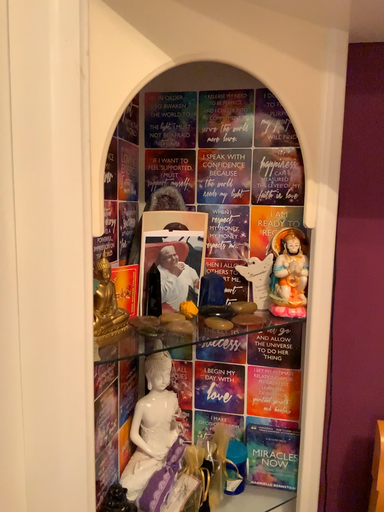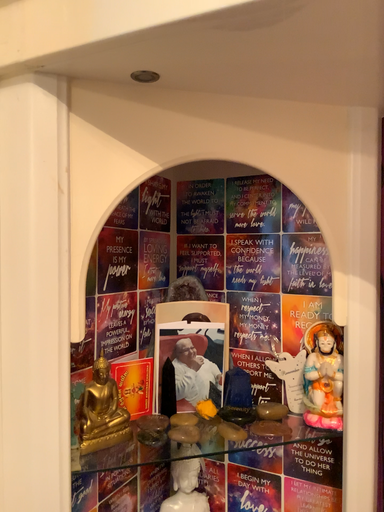
Question: How did the camera likely rotate when shooting the video?

Choices:
 (A) rotated upward
 (B) rotated downward

Answer: (A)